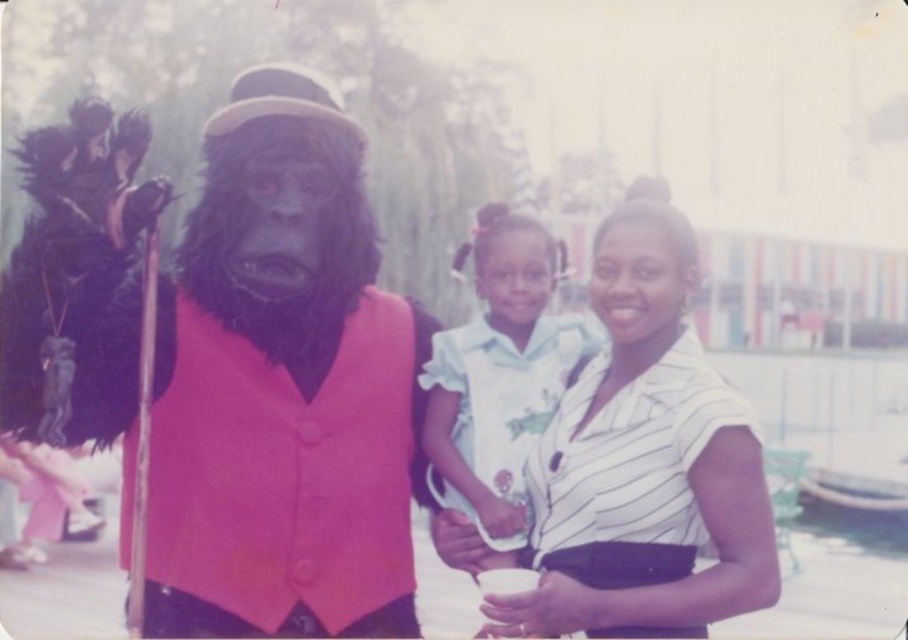
Question: Which object is closer to the camera taking this photo?

Choices:
 (A) white cotton dress at center
 (B) velvet pink vest at center
 (C) white striped shirt at center

Answer: (B)

Question: Is white striped shirt at center closer to the viewer compared to white cotton dress at center?

Choices:
 (A) no
 (B) yes

Answer: (B)

Question: Is velvet pink vest at center above white striped shirt at center?

Choices:
 (A) yes
 (B) no

Answer: (A)

Question: Does velvet pink vest at center appear on the right side of white striped shirt at center?

Choices:
 (A) yes
 (B) no

Answer: (B)

Question: Estimate the real-world distances between objects in this image. Which object is farther from the white cotton dress at center?

Choices:
 (A) velvet pink vest at center
 (B) white striped shirt at center

Answer: (A)

Question: Which object appears farthest from the camera in this image?

Choices:
 (A) white striped shirt at center
 (B) velvet pink vest at center

Answer: (A)